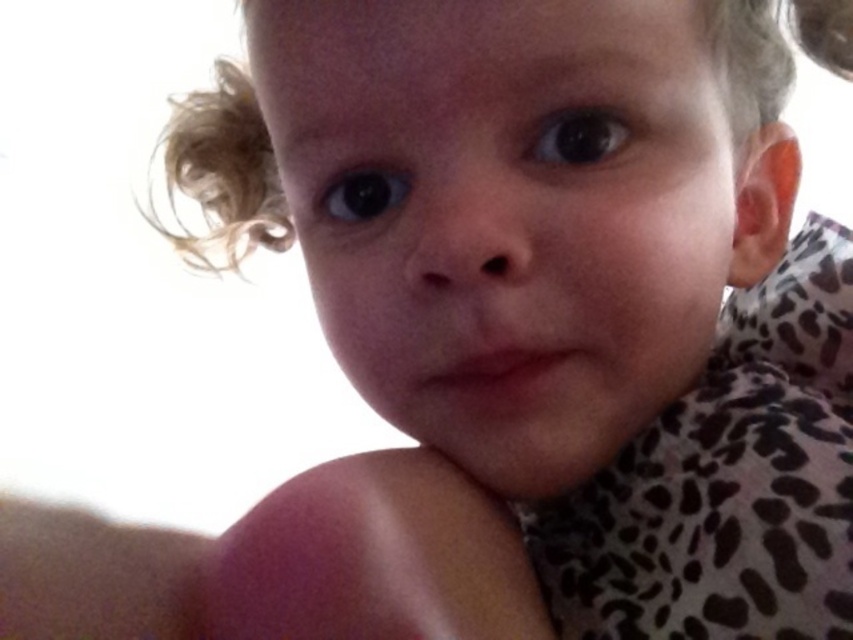
Question: Is curly blonde hair at upper left behind brown matte eye at center?

Choices:
 (A) no
 (B) yes

Answer: (B)

Question: Can you confirm if curly blonde hair at upper left is smaller than black glossy eye at upper left?

Choices:
 (A) yes
 (B) no

Answer: (B)

Question: Which object appears closest to the camera in this image?

Choices:
 (A) black glossy eye at upper left
 (B) smooth skin face at center

Answer: (B)

Question: Which of the following is the farthest from the observer?

Choices:
 (A) (502, 49)
 (B) (374, 172)

Answer: (B)

Question: Can you confirm if smooth skin face at center is positioned below black glossy eye at upper left?

Choices:
 (A) no
 (B) yes

Answer: (B)

Question: Among these points, which one is nearest to the camera?

Choices:
 (A) (399, 196)
 (B) (589, 157)
 (C) (607, 225)

Answer: (C)